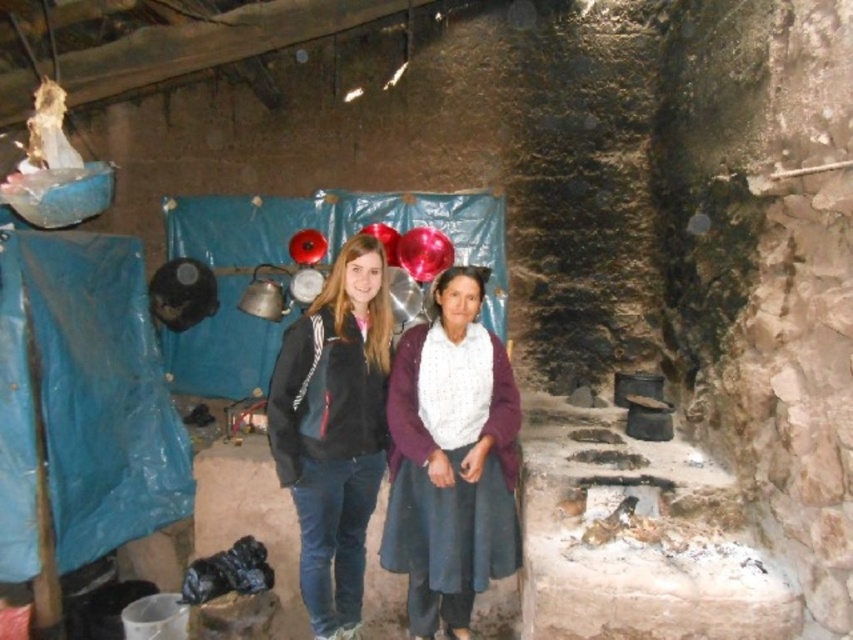
Who is lower down, white knitted sweater at center or black fleece jacket at center?

white knitted sweater at center is lower down.

Does point (434, 513) come in front of point (355, 595)?

That is True.

Identify the location of white knitted sweater at center. (451, 460).